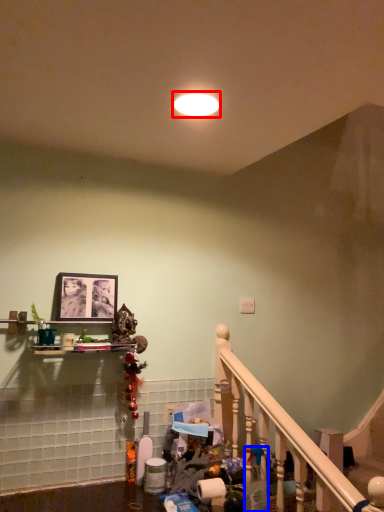
Question: Which of the following is the farthest to the observer, lighting (highlighted by a red box) or cleaning product (highlighted by a blue box)?

Choices:
 (A) lighting
 (B) cleaning product

Answer: (B)